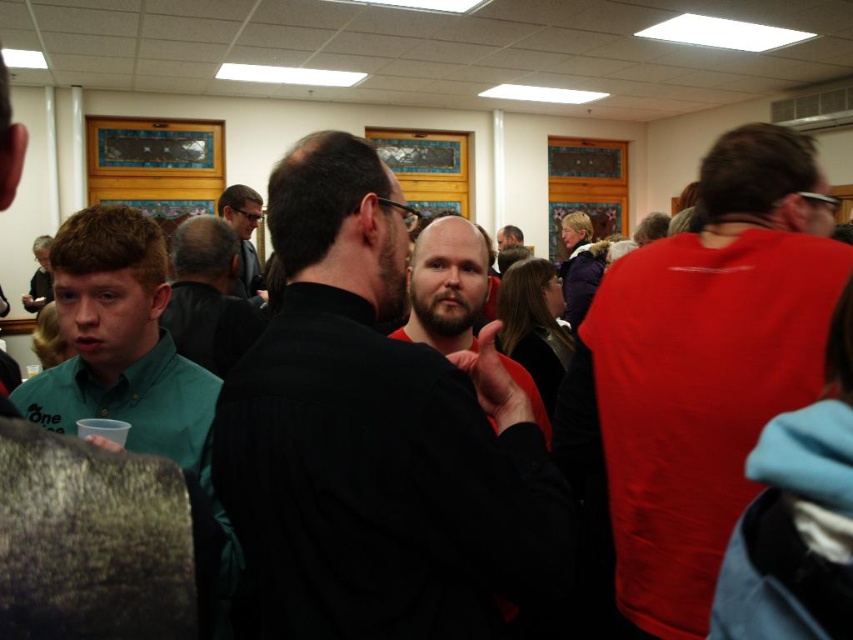
In the scene shown: You are standing in the room and want to locate the black matte shirt at center. What are the coordinates where you should look?

The black matte shirt at center is located at coordinates point (376, 436).

You are at a social event and want to approach the two men in the matte red shirt at right and the matte black shirt at left. Which man should you approach first if you want to reach the one closer to you?

You should approach the matte red shirt at right first because it is closer to the viewer than the matte black shirt at left.

You are trying to determine if the matte black glasses at center can fit into a box that is the same width as the matte black beard at center. Based on the spatial relationship between them, can the glasses fit?

The matte black glasses at center might be wider than the matte black beard at center, so they may not fit into a box sized for the beard.